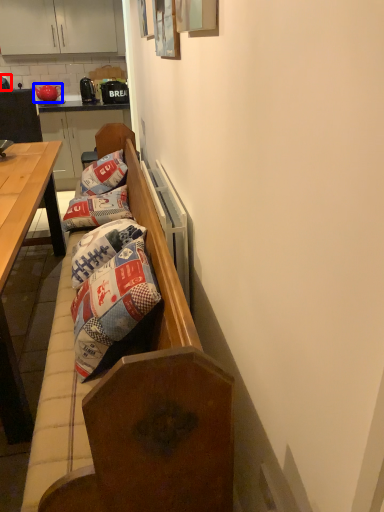
Question: Among these objects, which one is nearest to the camera, coffee cup (highlighted by a red box) or teapot (highlighted by a blue box)?

Choices:
 (A) coffee cup
 (B) teapot

Answer: (A)